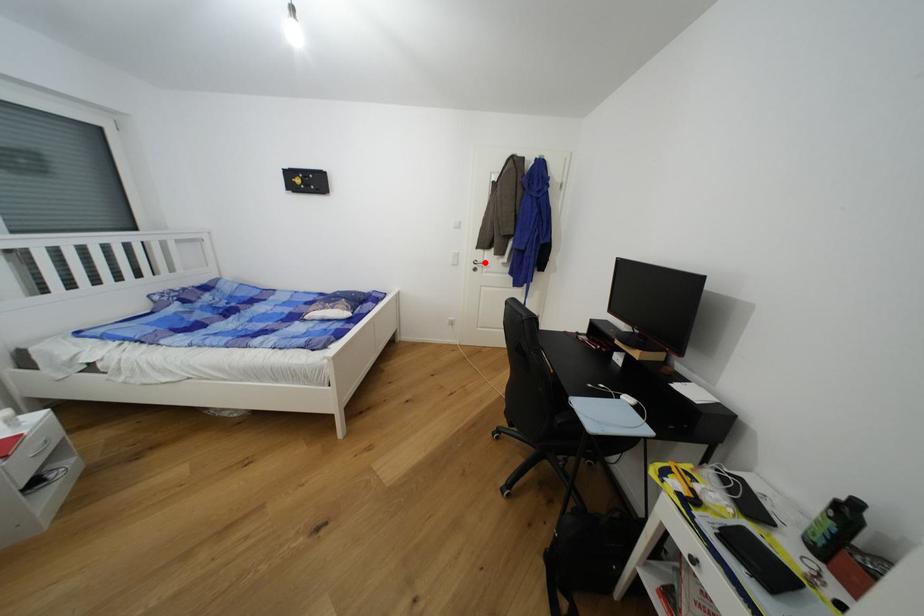
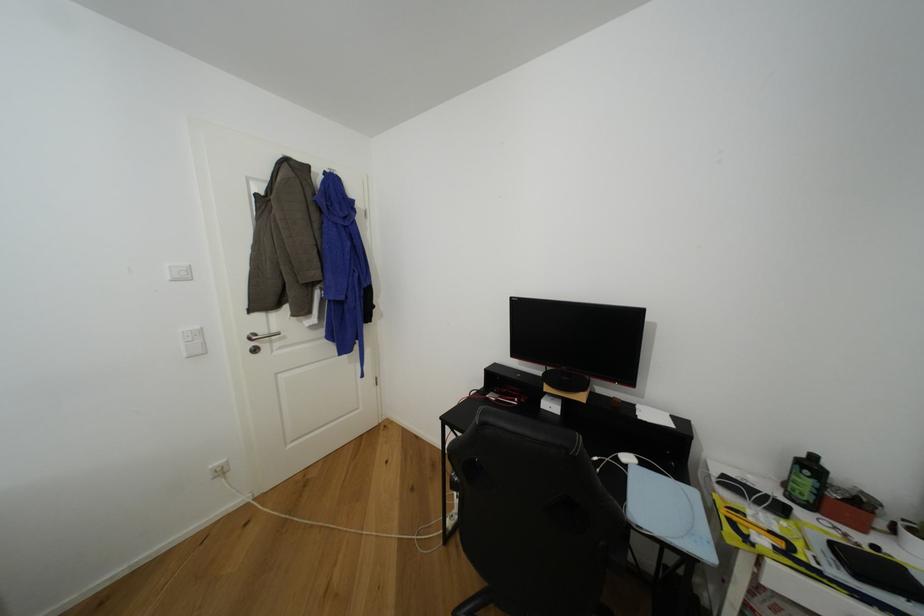
Where in the second image is the point corresponding to the highlighted location from the first image?

(268, 334)